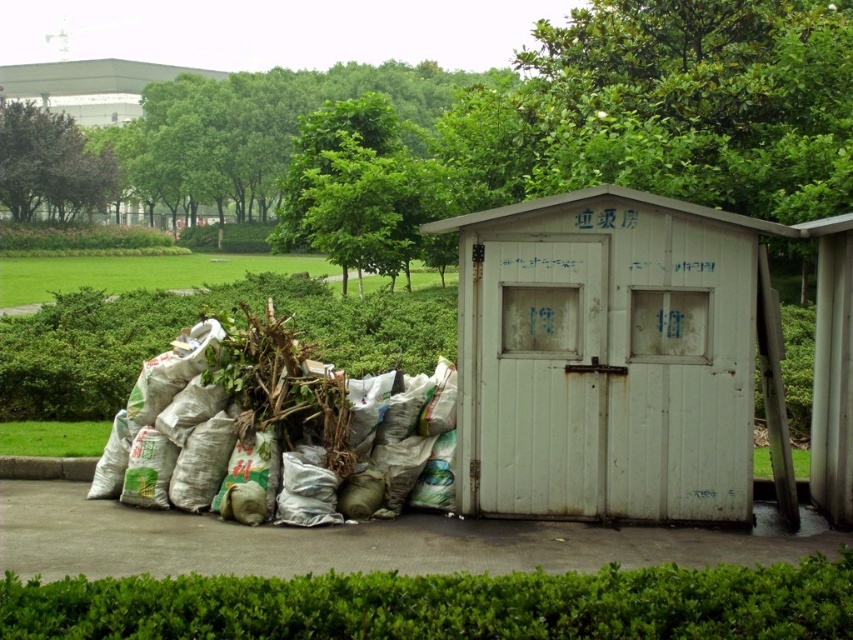
Question: Which object is farther from the camera taking this photo?

Choices:
 (A) white matte shed at center
 (B) green leafy tree at upper center

Answer: (B)

Question: Can you confirm if white matte shed at center is thinner than white painted wood hut at center?

Choices:
 (A) yes
 (B) no

Answer: (A)

Question: Is white matte shed at center below white fabric bags at center?

Choices:
 (A) no
 (B) yes

Answer: (A)

Question: Is white matte shed at center in front of green leafy tree at upper center?

Choices:
 (A) no
 (B) yes

Answer: (B)

Question: Which point is closer to the camera taking this photo?

Choices:
 (A) (581, 257)
 (B) (20, 216)
 (C) (630, 264)
 (D) (410, 381)

Answer: (C)

Question: Which object is closer to the camera taking this photo?

Choices:
 (A) green leafy tree at upper center
 (B) white painted wood hut at center
 (C) white matte shed at center

Answer: (B)